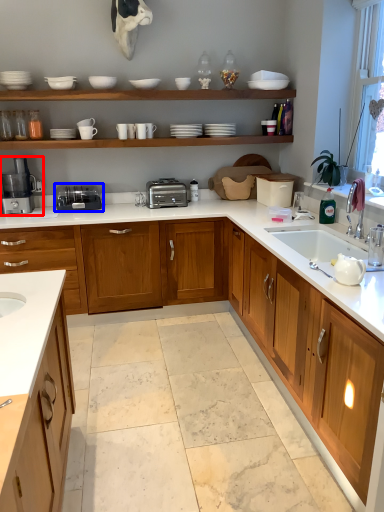
Question: Which point is further to the camera, coffee machine (highlighted by a red box) or appliance (highlighted by a blue box)?

Choices:
 (A) coffee machine
 (B) appliance

Answer: (B)